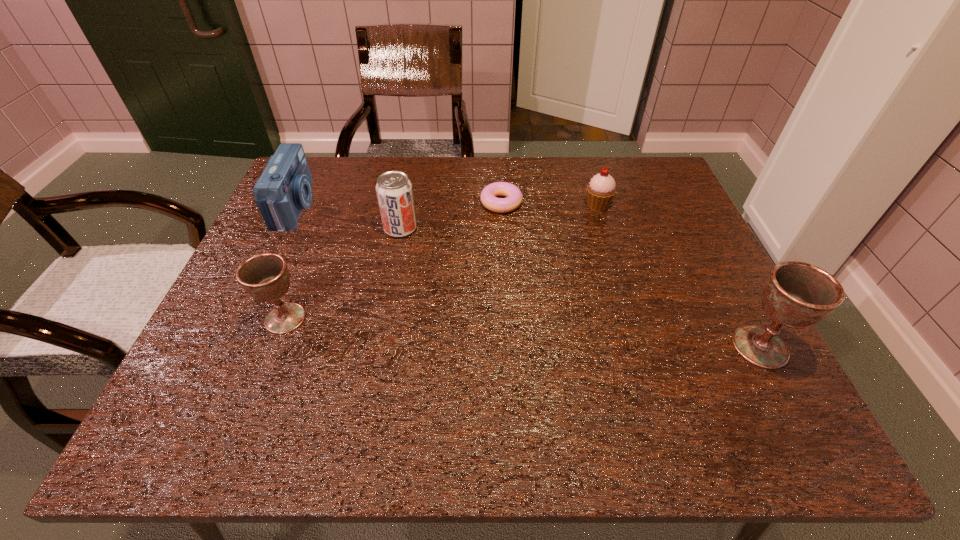
The width and height of the screenshot is (960, 540). I want to click on free space located on the left of the shorter chalice, so click(236, 318).

This screenshot has width=960, height=540. What are the coordinates of `free space located on the left of the taller chalice` in the screenshot? It's located at (687, 347).

At what (x,y) coordinates should I click in order to perform the action: click on free spot located on the front of the third object from right to left. Please return your answer as a coordinate pair (x, y). This screenshot has height=540, width=960. Looking at the image, I should click on (506, 287).

Where is `vacant space located on the lens of the camera`? vacant space located on the lens of the camera is located at coordinates (425, 207).

The width and height of the screenshot is (960, 540). What are the coordinates of `free point located 0.080m on the right of the second shortest object` in the screenshot? It's located at (641, 205).

At what (x,y) coordinates should I click in order to perform the action: click on vacant space located 0.200m on the front of the third object from left to right. Please return your answer as a coordinate pair (x, y). The image size is (960, 540). Looking at the image, I should click on (387, 299).

Find the location of a particular element. The height and width of the screenshot is (540, 960). doughnut at the far edge is located at coordinates (489, 194).

The image size is (960, 540). Identify the location of camera at the far edge. 284,188.

Identify the location of cupcake that is at the far edge. This screenshot has width=960, height=540. (601, 189).

I want to click on object present at the near edge, so click(796, 294).